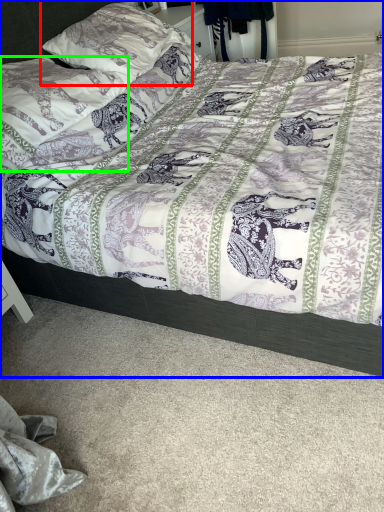
Question: Based on their relative distances, which object is farther from pillow (highlighted by a red box)? Choose from bed (highlighted by a blue box) and pillow (highlighted by a green box).

Choices:
 (A) bed
 (B) pillow

Answer: (A)